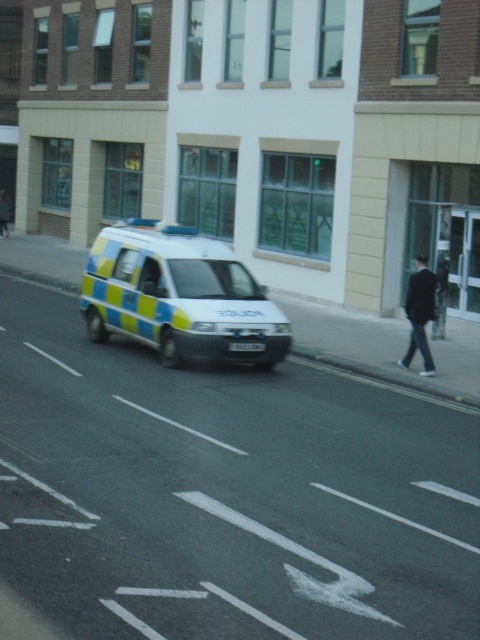
You are a delivery driver who needs to park your car in a parking spot that is exactly the width of the blue and yellow painted van at center. There is a dark blue fabric jacket at right nearby. Can you safely park your car without overlapping the jacket?

The blue and yellow painted van at center has a lesser width compared to dark blue fabric jacket at right. Since the parking spot is the same width as the van, it should be safe to park there without overlapping the jacket, as the jacket is wider but likely not occupying the parking space.

Consider the image. You are a driver who needs to park your car behind the blue and yellow painted van at center. The parking spot you want is right next to the dark blue fabric jacket at right. Can you safely park there without hitting the jacket?

The blue and yellow painted van at center is shorter than the dark blue fabric jacket at right, so the jacket is taller. Since the jacket is on the sidewalk, it might be part of a person, so you should not park too close to avoid obstructing the pedestrian area. Therefore, it is not safe to park there.

Consider the image. You are a pedestrian on the sidewalk to the right of the frame. You see the blue and yellow painted van at center represented by point (179,296). Is the van located to your left or right side?

The blue and yellow painted van at center is located to your left side because the point (179,296) represents its position in the frame, which would be to the left of the pedestrian standing on the right side of the frame.